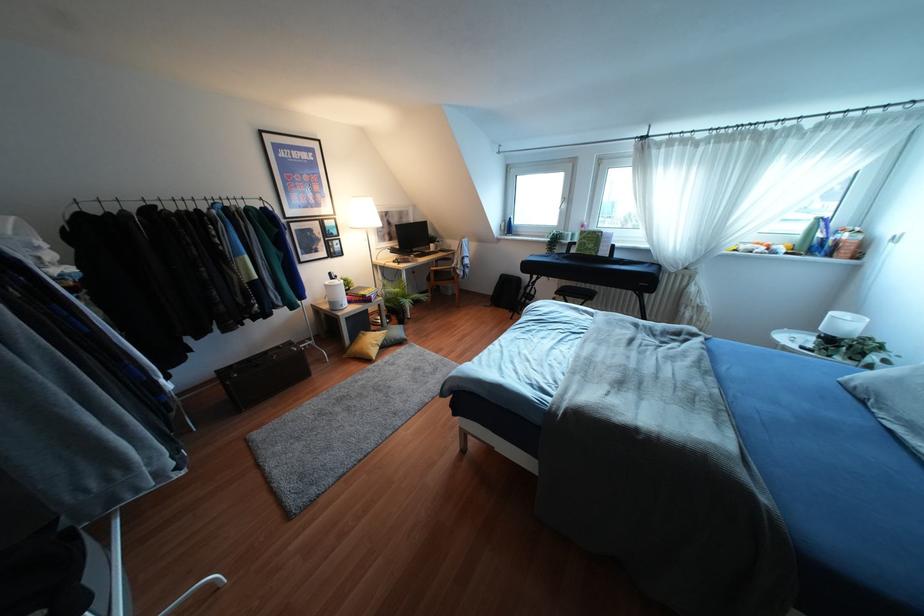
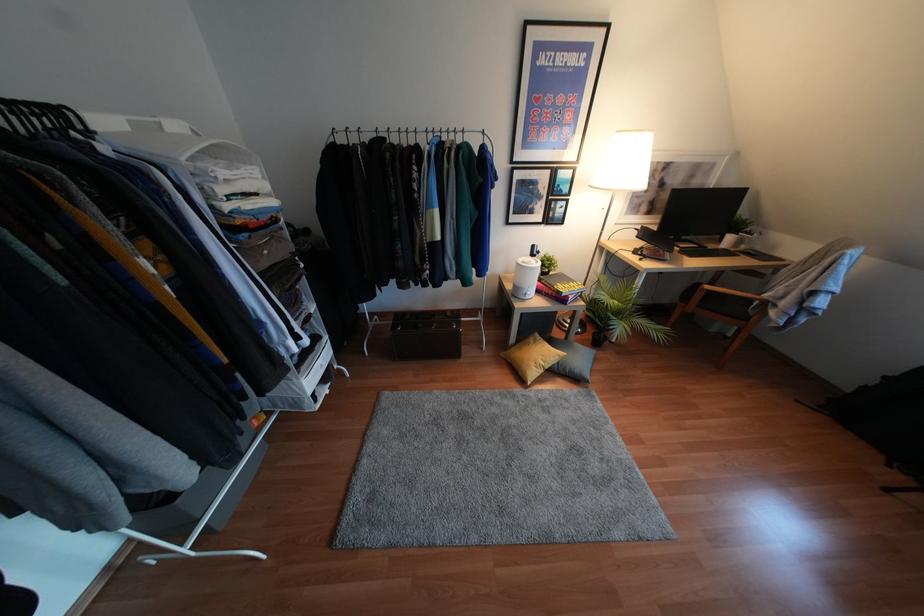
Locate, in the second image, the point that corresponds to (453,278) in the first image.

(745, 318)